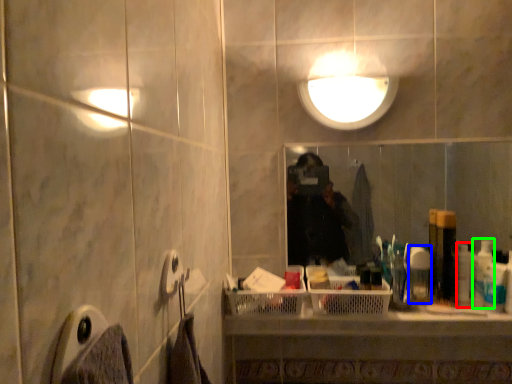
Question: Based on their relative distances, which object is nearer to toiletry (highlighted by a red box)? Choose from toiletry (highlighted by a blue box) and toiletry (highlighted by a green box).

Choices:
 (A) toiletry
 (B) toiletry

Answer: (B)